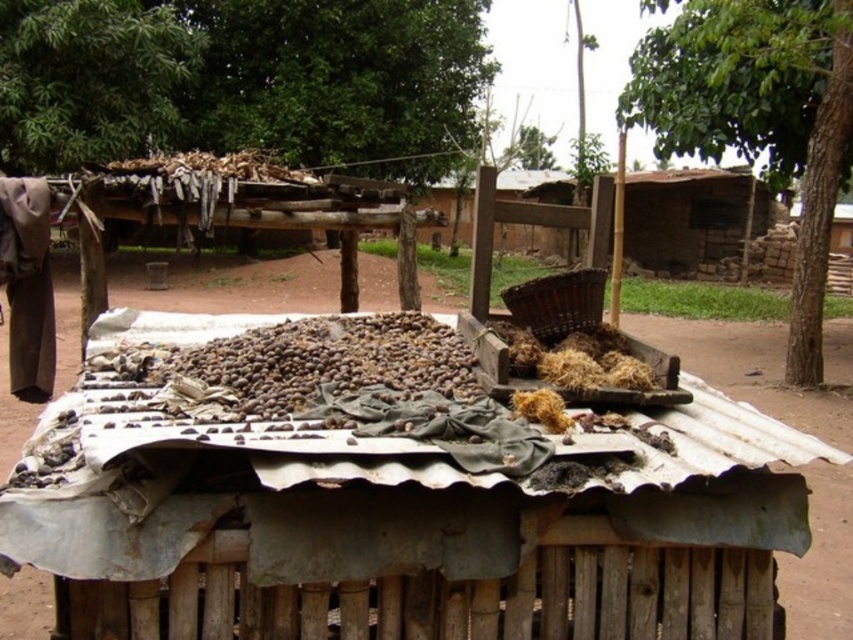
You are a farmer who wants to place a new basket on the brown dirt field at center. However, there is already a brown woven basket at center in the way. Based on their positions, which object is blocking your path to the desired location?

The brown woven basket at center is blocking the path because it is positioned to the left of the brown dirt field at center, meaning it is in the way when approaching from the right side.

You are a delivery person who needs to place a heavy box on the structure. The box requires a flat area free of the brown matte nuts at center. Based on the coordinates provided, is there enough space to place the box on the structure?

The brown matte nuts at center are located at coordinates point (300,369). Since the nuts are at the center, there might be space around them to place the box, but the exact availability depends on the box size and the total area of the structure.

You are a farmer who needs to move a bag of seeds from the brown dirt field at center to the brown woven basket at center. Given that your wheelbarrow can carry items up to 15 meters, will you be able to transport the seeds without needing to unload midway?

The brown dirt field at center and brown woven basket at center are 12.97 meters apart. Since the distance is less than the wheelbarrow capacity of 15 meters, you can transport the seeds without unloading midway.